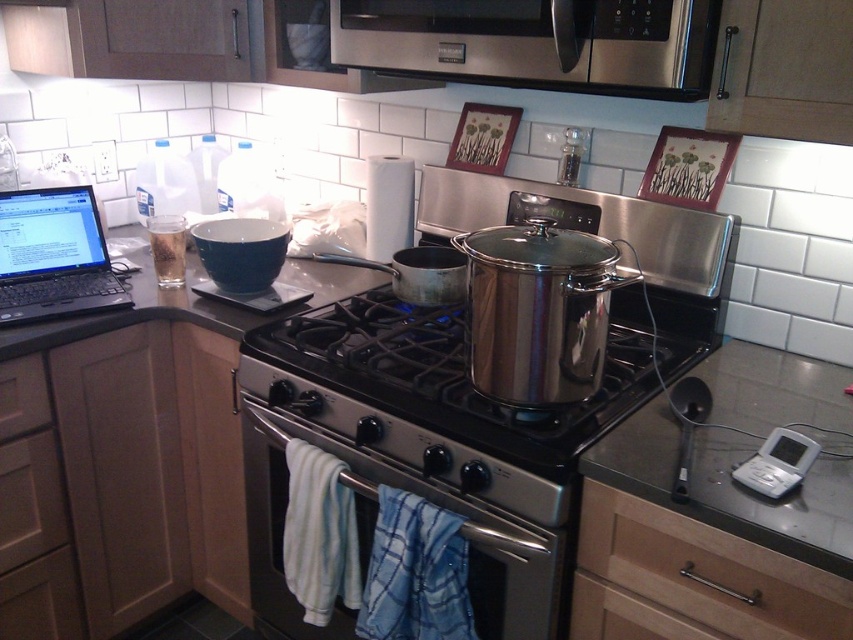
You are a chef who needs to place a 12 inch tall cake on the smooth granite countertop at center and the stainless steel oven at center. Which surface can accommodate the cake without it toppling over?

The smooth granite countertop at center is much taller than the stainless steel oven at center, so placing the cake on the smooth granite countertop at center would provide a stable surface to prevent it from toppling over.

You are a chef who needs to check the oven. You are currently standing in front of the black matte laptop at upper left. Which direction should you move to reach the stainless steel oven at center first?

Since the stainless steel oven at center is closer to the viewer than the black matte laptop at upper left, you should move forward from the black matte laptop at upper left towards the center of the scene to reach the stainless steel oven at center first.